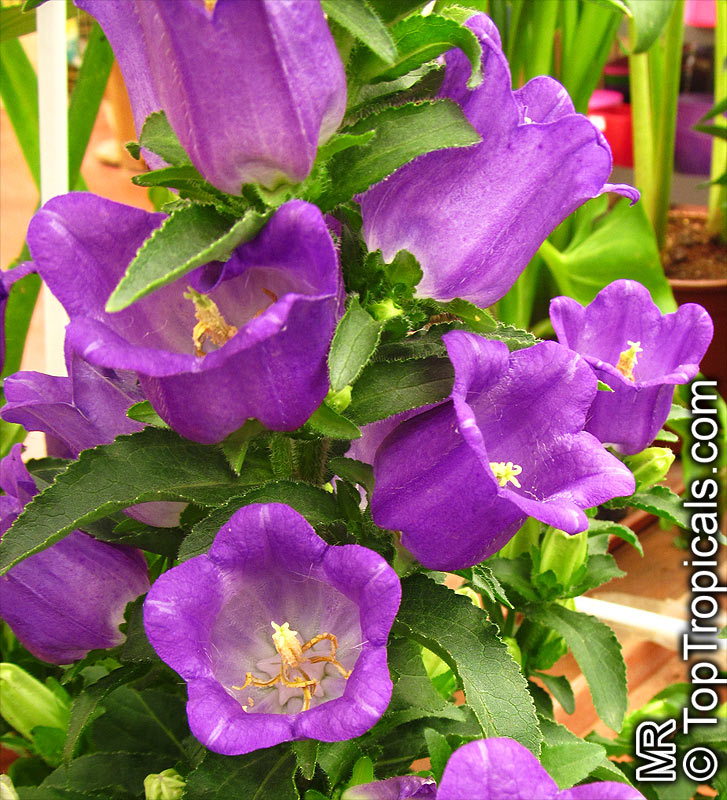
In order to click on flower pot in this screenshot , I will do `click(714, 290)`.